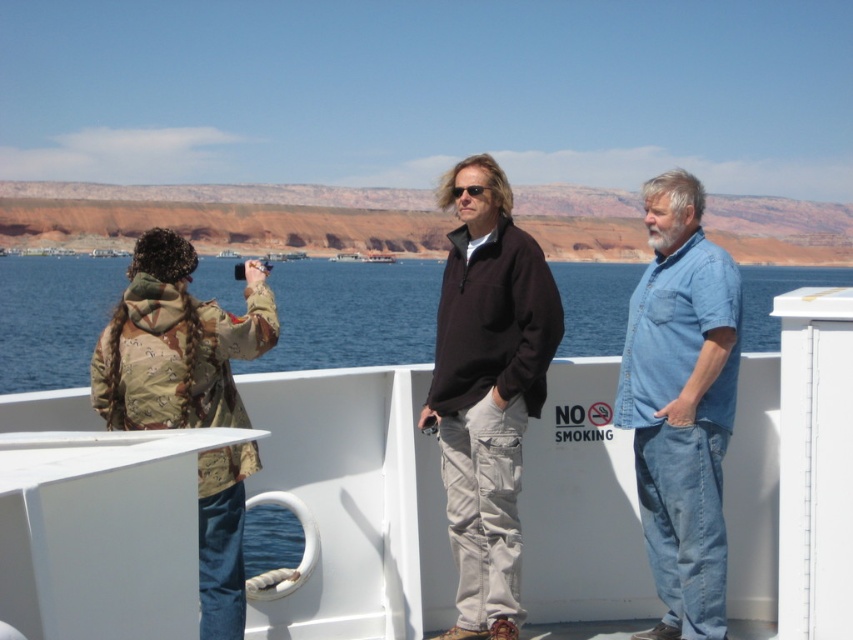
I want to click on blue water at center, so click(351, 314).

Between point (585, 269) and point (717, 468), which one is positioned behind?

The point (585, 269) is behind.

Does point (387, 284) come closer to viewer compared to point (643, 332)?

No, (387, 284) is further to viewer.

Where is `blue water at center`? blue water at center is located at coordinates (351, 314).

Which is more to the right, white matte boat at center or blue denim shirt at right?

Positioned to the right is blue denim shirt at right.

Is white matte boat at center closer to the viewer compared to blue denim shirt at right?

No, white matte boat at center is behind blue denim shirt at right.

This screenshot has height=640, width=853. Describe the element at coordinates (248, 499) in the screenshot. I see `white matte boat at center` at that location.

This screenshot has width=853, height=640. I want to click on white matte boat at center, so click(248, 499).

Between point (544, 602) and point (524, 276), which one is positioned behind?

Point (544, 602)

Between white matte boat at center and dark brown fleece at center, which one has less height?

white matte boat at center

Which is behind, point (402, 516) or point (492, 340)?

Point (492, 340)

The width and height of the screenshot is (853, 640). What are the coordinates of `white matte boat at center` in the screenshot? It's located at (248, 499).